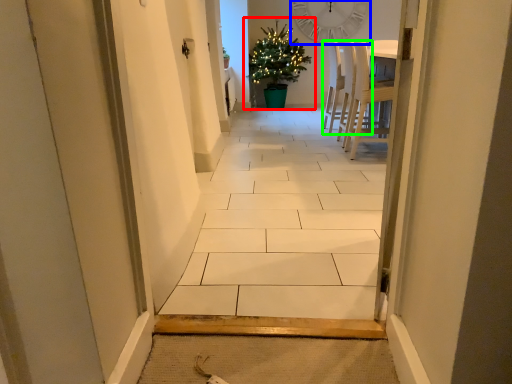
Question: Considering the real-world distances, which object is closest to houseplant (highlighted by a red box)? clock (highlighted by a blue box) or chair (highlighted by a green box).

Choices:
 (A) clock
 (B) chair

Answer: (A)